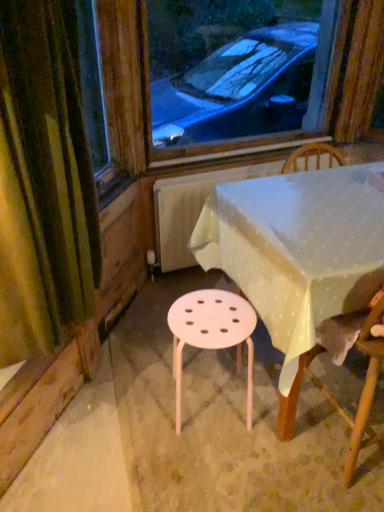
You are a GUI agent. You are given a task and a screenshot of the screen. Output one action in this format:
    pyautogui.click(x=<x>, y=<y>)
    Task: Click on the pink plastic stool at center
    
    Given the screenshot: What is the action you would take?
    pyautogui.click(x=211, y=332)

Where is `wooden chair at lower right`? This screenshot has width=384, height=512. wooden chair at lower right is located at coordinates (334, 397).

Locate an element on the screen. The height and width of the screenshot is (512, 384). pink plastic stool at center is located at coordinates (211, 332).

Looking at the image, does green fabric curtain at left seem bigger or smaller compared to wooden chair at lower right?

Clearly, green fabric curtain at left is smaller in size than wooden chair at lower right.

Does green fabric curtain at left have a lesser height compared to wooden chair at lower right?

In fact, green fabric curtain at left may be taller than wooden chair at lower right.

Are green fabric curtain at left and wooden chair at lower right beside each other?

No, green fabric curtain at left is not beside wooden chair at lower right.

Measure the distance from green fabric curtain at left to wooden chair at lower right.

The distance of green fabric curtain at left from wooden chair at lower right is 34.10 inches.

Which is more to the left, wooden chair at lower right or pink plastic stool at center?

From the viewer's perspective, pink plastic stool at center appears more on the left side.

Considering the relative sizes of wooden chair at lower right and pink plastic stool at center in the image provided, is wooden chair at lower right taller than pink plastic stool at center?

Correct, wooden chair at lower right is much taller as pink plastic stool at center.

Is pink plastic stool at center surrounded by wooden chair at lower right?

No, pink plastic stool at center is not a part of wooden chair at lower right.

In the scene shown: Is the surface of green fabric curtain at left in direct contact with white plastic table at center?

green fabric curtain at left is not next to white plastic table at center, and they're not touching.

Which object is thinner, green fabric curtain at left or white plastic table at center?

With smaller width is green fabric curtain at left.

Is green fabric curtain at left not within white plastic table at center?

green fabric curtain at left is positioned outside white plastic table at center.

Is wooden chair at lower right wider or thinner than white plastic table at center?

wooden chair at lower right is thinner than white plastic table at center.

How much distance is there between wooden chair at lower right and white plastic table at center?

A distance of 13.67 inches exists between wooden chair at lower right and white plastic table at center.

Is point (366, 319) in front of point (270, 311)?

That is True.

Between wooden chair at lower right and white plastic table at center, which one has less height?

white plastic table at center.

Which object is thinner, pink plastic stool at center or wooden chair at lower right?

pink plastic stool at center.

Is pink plastic stool at center oriented away from wooden chair at lower right?

No, pink plastic stool at center is not facing away from wooden chair at lower right.

Which is more to the left, pink plastic stool at center or wooden chair at lower right?

pink plastic stool at center is more to the left.

Is pink plastic stool at center not inside wooden chair at lower right?

Yes, pink plastic stool at center is outside of wooden chair at lower right.

Based on the photo, can you tell me how much white plastic table at center and wooden chair at lower right differ in facing direction?

6.6e-05 degrees separate the facing orientations of white plastic table at center and wooden chair at lower right.

How distant is white plastic table at center from wooden chair at lower right?

white plastic table at center and wooden chair at lower right are 13.67 inches apart.

Is white plastic table at center looking in the opposite direction of wooden chair at lower right?

Yes, white plastic table at center is facing away from wooden chair at lower right.

From a real-world perspective, is white plastic table at center beneath wooden chair at lower right?

Correct, in the physical world, white plastic table at center is lower than wooden chair at lower right.

Looking at the image, does wooden chair at lower right seem bigger or smaller compared to green fabric curtain at left?

Considering their sizes, wooden chair at lower right takes up more space than green fabric curtain at left.

Based on the photo, from a real-world perspective, which is physically below, wooden chair at lower right or green fabric curtain at left?

In real-world perspective, wooden chair at lower right is lower.

Which of these two, wooden chair at lower right or green fabric curtain at left, is thinner?

green fabric curtain at left.

Is wooden chair at lower right oriented away from green fabric curtain at left?

No, wooden chair at lower right is not facing the opposite direction of green fabric curtain at left.

The image size is (384, 512). Find the location of `curtain lying in front of the wooden chair at lower right`. curtain lying in front of the wooden chair at lower right is located at coordinates (44, 191).

Find the location of a particular element. The image size is (384, 512). stool below the wooden chair at lower right (from the image's perspective) is located at coordinates (211, 332).

Considering their positions, is green fabric curtain at left positioned closer to wooden chair at lower right than pink plastic stool at center?

Based on the image, pink plastic stool at center appears to be nearer to wooden chair at lower right.

Based on their spatial positions, is white plastic table at center or green fabric curtain at left further from pink plastic stool at center?

green fabric curtain at left is further to pink plastic stool at center.

Considering their positions, is green fabric curtain at left positioned closer to wooden chair at lower right than white plastic table at center?

A: white plastic table at center.

When comparing their distances from pink plastic stool at center, does wooden chair at lower right or white plastic table at center seem further?

The object further to pink plastic stool at center is wooden chair at lower right.

Looking at the image, which one is located closer to pink plastic stool at center, white plastic table at center or wooden chair at lower right?

The object closer to pink plastic stool at center is white plastic table at center.

Estimate the real-world distances between objects in this image. Which object is further from green fabric curtain at left, pink plastic stool at center or wooden chair at lower right?

Among the two, wooden chair at lower right is located further to green fabric curtain at left.

Looking at the image, which one is located closer to wooden chair at lower right, pink plastic stool at center or green fabric curtain at left?

pink plastic stool at center lies closer to wooden chair at lower right than the other object.

When comparing their distances from wooden chair at lower right, does white plastic table at center or pink plastic stool at center seem closer?

pink plastic stool at center is closer to wooden chair at lower right.

Identify the location of stool between green fabric curtain at left and white plastic table at center in the horizontal direction. Image resolution: width=384 pixels, height=512 pixels. (211, 332).

Where is `stool between green fabric curtain at left and wooden chair at lower right`? stool between green fabric curtain at left and wooden chair at lower right is located at coordinates (211, 332).

Where is `chair between green fabric curtain at left and white plastic table at center in the horizontal direction`? This screenshot has height=512, width=384. chair between green fabric curtain at left and white plastic table at center in the horizontal direction is located at coordinates pos(334,397).

In order to click on chair situated between pink plastic stool at center and white plastic table at center from left to right in this screenshot , I will do `click(334, 397)`.